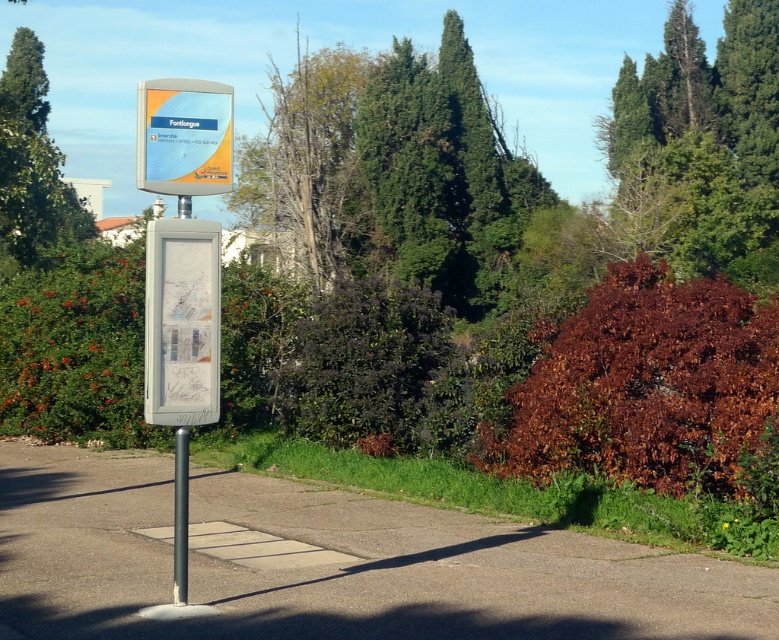
Question: Does matte plastic sign at center appear on the right side of smooth gray pole at center?

Choices:
 (A) no
 (B) yes

Answer: (B)

Question: Does green leafy tree at upper right appear on the right side of white plastic map at center?

Choices:
 (A) yes
 (B) no

Answer: (A)

Question: Which object is positioned farthest from the white plastic map at center?

Choices:
 (A) matte plastic sign at center
 (B) smooth gray pole at center
 (C) green leafy tree at upper right

Answer: (C)

Question: Which point is farther to the camera?

Choices:
 (A) green leafy tree at upper right
 (B) matte plastic sign at center

Answer: (A)

Question: Does dead wood tree at center appear on the left side of matte plastic sign at center?

Choices:
 (A) yes
 (B) no

Answer: (A)

Question: Which of the following is the closest to the observer?

Choices:
 (A) (177, 586)
 (B) (367, 246)

Answer: (A)